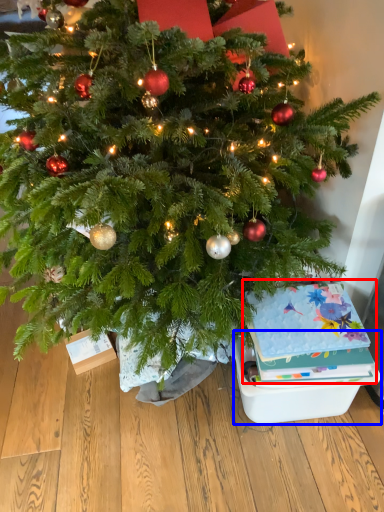
Question: Which of the following is the farthest to the observer, christmas card (highlighted by a red box) or storage box (highlighted by a blue box)?

Choices:
 (A) christmas card
 (B) storage box

Answer: (B)